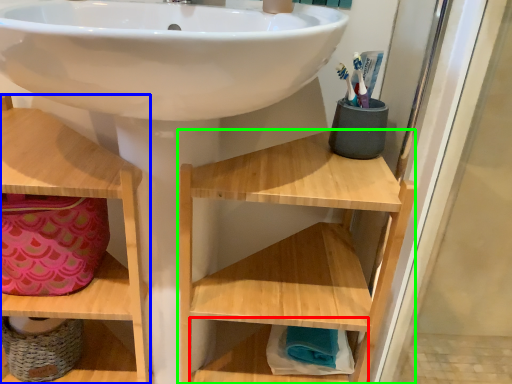
Question: Which object is the farthest from shelf (highlighted by a red box)? Choose among these: shelf (highlighted by a blue box) or shelf (highlighted by a green box).

Choices:
 (A) shelf
 (B) shelf

Answer: (A)